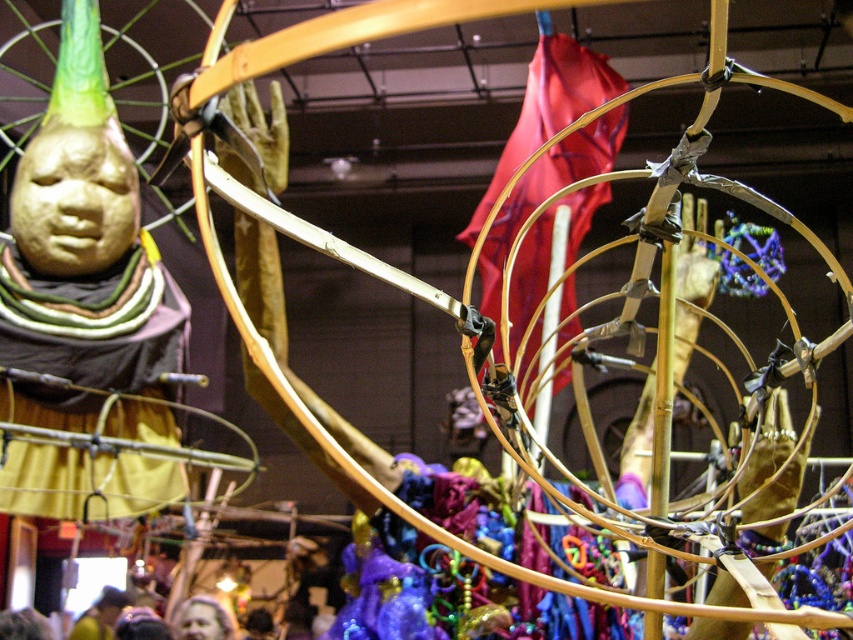
Is smooth skin face at lower center to the left of yellow fabric at lower left from the viewer's perspective?

In fact, smooth skin face at lower center is to the right of yellow fabric at lower left.

Identify the location of smooth skin face at lower center. Image resolution: width=853 pixels, height=640 pixels. (201, 620).